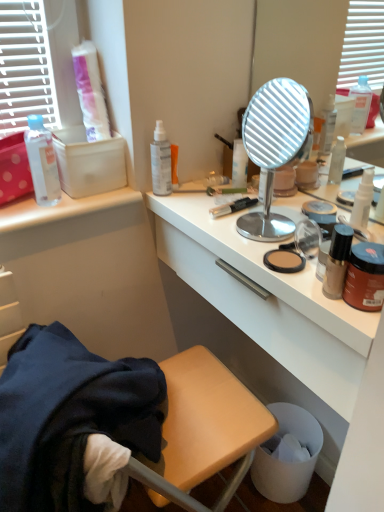
Image resolution: width=384 pixels, height=512 pixels. What are the coordinates of `white plastic trash can at lower right` in the screenshot? It's located at (288, 463).

Image resolution: width=384 pixels, height=512 pixels. In order to click on transparent plastic bottle at upper left, which is the 1th bottle in left-to-right order in this screenshot , I will do `click(42, 162)`.

What is the approximate height of white glossy desk at center?

It is 7.87 inches.

What do you see at coordinates (274, 148) in the screenshot? The width and height of the screenshot is (384, 512). I see `metallic round mirror at center` at bounding box center [274, 148].

Find the location of a particular element. Image resolution: width=384 pixels, height=512 pixels. metallic round mirror at center is located at coordinates point(274,148).

The image size is (384, 512). In order to click on transparent plastic spray bottle at upper center, placed as the 4th bottle when sorted from front to back in this screenshot , I will do `click(161, 161)`.

The width and height of the screenshot is (384, 512). Find the location of `brown matte jar at right`. brown matte jar at right is located at coordinates (365, 277).

Considering the sizes of objects transparent plastic bottle at upper left, the 4th bottle positioned from the right, and brown matte jar at right in the image provided, who is wider, transparent plastic bottle at upper left, the 4th bottle positioned from the right, or brown matte jar at right?

With larger width is transparent plastic bottle at upper left, the 4th bottle positioned from the right.

Considering the positions of objects transparent plastic bottle at upper left, which is the 1th bottle in left-to-right order, and brown matte jar at right in the image provided, who is more to the right, transparent plastic bottle at upper left, which is the 1th bottle in left-to-right order, or brown matte jar at right?

Positioned to the right is brown matte jar at right.

Can brown matte jar at right be found inside transparent plastic bottle at upper left, which is the 1th bottle in left-to-right order?

Actually, brown matte jar at right is outside transparent plastic bottle at upper left, which is the 1th bottle in left-to-right order.

Is white cardboard box at upper left oriented away from brown matte jar at right?

No.

Is white cardboard box at upper left surrounding brown matte jar at right?

No, brown matte jar at right is not surrounded by white cardboard box at upper left.

What are the coordinates of `cosmetic below the white cardboard box at upper left (from the image's perspective)` in the screenshot? It's located at (365, 277).

In terms of width, does white cardboard box at upper left look wider or thinner when compared to brown matte jar at right?

In the image, white cardboard box at upper left appears to be wider than brown matte jar at right.

Does white glossy spray bottle at upper right, which ranks as the 2th bottle in front-to-back order, touch white plastic trash can at lower right?

No, white glossy spray bottle at upper right, which ranks as the 2th bottle in front-to-back order, is not making contact with white plastic trash can at lower right.

Does white glossy spray bottle at upper right, the 3th bottle from the back, turn towards white plastic trash can at lower right?

No, white glossy spray bottle at upper right, the 3th bottle from the back, does not turn towards white plastic trash can at lower right.

From the image's perspective, is white glossy spray bottle at upper right, the 1th bottle from the right, located beneath white plastic trash can at lower right?

Incorrect, from the image's perspective, white glossy spray bottle at upper right, the 1th bottle from the right, is higher than white plastic trash can at lower right.

Looking at this image, which object is further away from the camera, white glossy spray bottle at upper right, which ranks as the 2th bottle in front-to-back order, or white plastic trash can at lower right?

white plastic trash can at lower right.

Is translucent plastic spray bottle at upper center smaller than metallic round mirror at center?

Yes, translucent plastic spray bottle at upper center is smaller than metallic round mirror at center.

You are a GUI agent. You are given a task and a screenshot of the screen. Output one action in this format:
    pyautogui.click(x=<x>, y=<y>)
    Task: Click on the mirror above the translucent plastic spray bottle at upper center (from a real-world perspective)
    
    Given the screenshot: What is the action you would take?
    pyautogui.click(x=274, y=148)

Is translucent plastic spray bottle at upper center not near metallic round mirror at center?

That's not correct — translucent plastic spray bottle at upper center is a little close to metallic round mirror at center.

Considering the points (174, 179) and (300, 156), which point is behind, point (174, 179) or point (300, 156)?

The point (300, 156) is farther from the camera.

How different are the orientations of white plastic trash can at lower right and transparent plastic bottle at upper left, which ranks as the third bottle in front-to-back order, in degrees?

The facing directions of white plastic trash can at lower right and transparent plastic bottle at upper left, which ranks as the third bottle in front-to-back order, are 94.2 degrees apart.

In the scene shown: Is white plastic trash can at lower right completely or partially outside of transparent plastic bottle at upper left, the 4th bottle positioned from the right?

Yes, white plastic trash can at lower right is not within transparent plastic bottle at upper left, the 4th bottle positioned from the right.

In terms of height, does white plastic trash can at lower right look taller or shorter compared to transparent plastic bottle at upper left, which is the 1th bottle in left-to-right order?

white plastic trash can at lower right is taller than transparent plastic bottle at upper left, which is the 1th bottle in left-to-right order.

Considering the sizes of objects white plastic trash can at lower right and transparent plastic bottle at upper left, the 4th bottle positioned from the right, in the image provided, who is thinner, white plastic trash can at lower right or transparent plastic bottle at upper left, the 4th bottle positioned from the right,?

Thinner between the two is transparent plastic bottle at upper left, the 4th bottle positioned from the right.

Is point (357, 214) closer or farther from the camera than point (170, 180)?

Point (357, 214).

Considering the sizes of white glossy spray bottle at upper right, which is counted as the fourth bottle, starting from the left, and transparent plastic spray bottle at upper center, which ranks as the 3th bottle in right-to-left order, in the image, is white glossy spray bottle at upper right, which is counted as the fourth bottle, starting from the left, bigger or smaller than transparent plastic spray bottle at upper center, which ranks as the 3th bottle in right-to-left order,?

Clearly, white glossy spray bottle at upper right, which is counted as the fourth bottle, starting from the left, is smaller in size than transparent plastic spray bottle at upper center, which ranks as the 3th bottle in right-to-left order.

Is white glossy spray bottle at upper right, the 1th bottle from the right, to the left of transparent plastic spray bottle at upper center, placed as the 4th bottle when sorted from front to back, from the viewer's perspective?

In fact, white glossy spray bottle at upper right, the 1th bottle from the right, is to the right of transparent plastic spray bottle at upper center, placed as the 4th bottle when sorted from front to back.

Considering the sizes of objects white glossy spray bottle at upper right, the 1th bottle from the right, and transparent plastic spray bottle at upper center, placed as the 4th bottle when sorted from front to back, in the image provided, who is taller, white glossy spray bottle at upper right, the 1th bottle from the right, or transparent plastic spray bottle at upper center, placed as the 4th bottle when sorted from front to back,?

With more height is transparent plastic spray bottle at upper center, placed as the 4th bottle when sorted from front to back.

In the scene shown: Which of these two, white glossy desk at center or white cardboard box at upper left, is bigger?

Bigger between the two is white glossy desk at center.

Considering the positions of objects white glossy desk at center and white cardboard box at upper left in the image provided, who is more to the right, white glossy desk at center or white cardboard box at upper left?

white glossy desk at center.

What's the angular difference between white glossy desk at center and white cardboard box at upper left's facing directions?

The facing directions of white glossy desk at center and white cardboard box at upper left are 93 degrees apart.

Between white glossy desk at center and white cardboard box at upper left, which one has less height?

white cardboard box at upper left is shorter.

Locate an element on the screen. the 3rd bottle behind the brown matte jar at right is located at coordinates (42, 162).

You are a GUI agent. You are given a task and a screenshot of the screen. Output one action in this format:
    pyautogui.click(x=<x>, y=<y>)
    Task: Click on the cosmetic below the white cardboard box at upper left (from a real-world perspective)
    
    Given the screenshot: What is the action you would take?
    pyautogui.click(x=365, y=277)

From the image, which object appears to be farther from brown matte jar at right, white plastic trash can at lower right or translucent plastic spray bottle at upper center?

white plastic trash can at lower right is positioned further to the anchor brown matte jar at right.

From the image, which object appears to be farther from white cardboard box at upper left, white glossy spray bottle at upper right, the 1th bottle from the right, or translucent plastic spray bottle at upper center?

white glossy spray bottle at upper right, the 1th bottle from the right, is further to white cardboard box at upper left.

Looking at the image, which one is located further to matte black bottle at right, which is counted as the second bottle, starting from the right, white glossy desk at center or metallic round mirror at center?

Based on the image, metallic round mirror at center appears to be further to matte black bottle at right, which is counted as the second bottle, starting from the right.

Looking at the image, which one is located closer to white glossy spray bottle at upper right, the 1th bottle from the right, transparent plastic spray bottle at upper center, marked as the 1th bottle in a back-to-front arrangement, or white glossy desk at center?

white glossy desk at center lies closer to white glossy spray bottle at upper right, the 1th bottle from the right, than the other object.

Which object lies further to the anchor point matte black bottle at right, the 1th bottle positioned from the front, white glossy spray bottle at upper right, which is counted as the fourth bottle, starting from the left, or transparent plastic spray bottle at upper center, marked as the 1th bottle in a back-to-front arrangement?

The object further to matte black bottle at right, the 1th bottle positioned from the front, is transparent plastic spray bottle at upper center, marked as the 1th bottle in a back-to-front arrangement.

Estimate the real-world distances between objects in this image. Which object is further from translucent plastic spray bottle at upper center, white plastic trash can at lower right or wooden stool at lower left?

The object further to translucent plastic spray bottle at upper center is white plastic trash can at lower right.

Based on their spatial positions, is white plastic trash can at lower right or matte black bottle at right, the 1th bottle positioned from the front, further from metallic round mirror at center?

white plastic trash can at lower right lies further to metallic round mirror at center than the other object.

Looking at the image, which one is located further to metallic round mirror at center, white glossy desk at center or transparent plastic spray bottle at upper center, placed as the 4th bottle when sorted from front to back?

white glossy desk at center.

Locate an element on the screen. desk between matte black bottle at right, the fourth bottle when ordered from back to front, and wooden stool at lower left from top to bottom is located at coordinates [x=272, y=311].

Find the location of `desk between wooden stool at lower left and brown matte jar at right`. desk between wooden stool at lower left and brown matte jar at right is located at coordinates (272, 311).

Find the location of a particular element. The image size is (384, 512). toiletry between transparent plastic spray bottle at upper center, which ranks as the 3th bottle in right-to-left order, and white glossy spray bottle at upper right, the 1th bottle from the right is located at coordinates (174, 165).

Locate an element on the screen. desk between wooden stool at lower left and white plastic trash can at lower right from front to back is located at coordinates (272, 311).